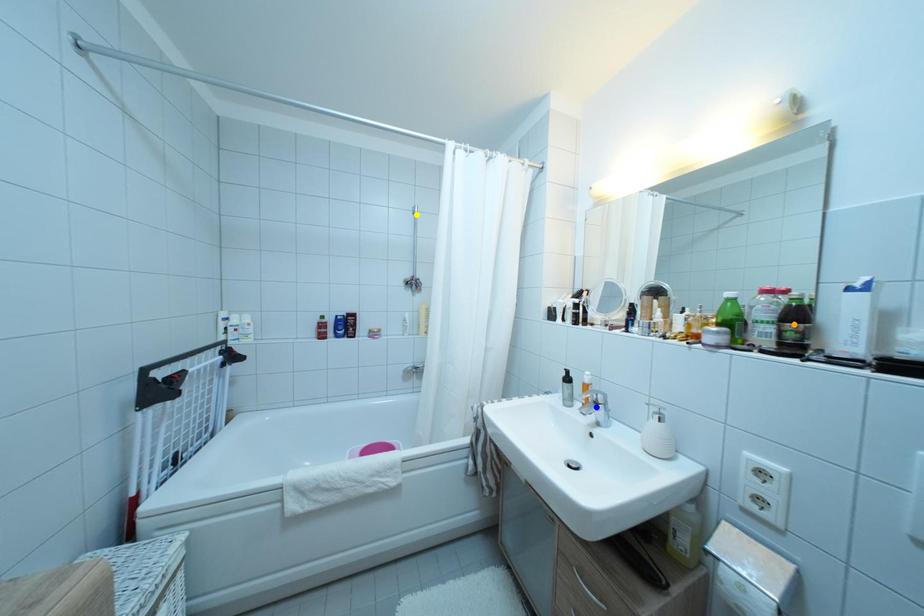
Looking at this image, order these from nearest to farthest:
1. orange point
2. yellow point
3. blue point

orange point
blue point
yellow point